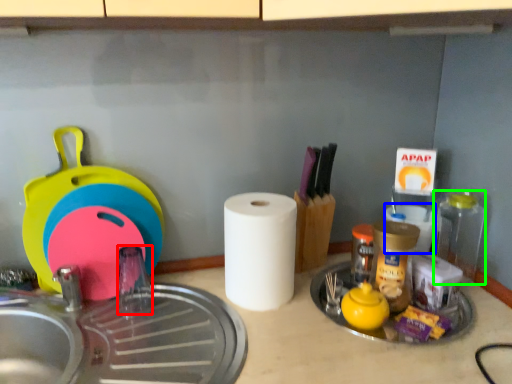
Question: Which object is positioned closest to faucet (highlighted by a red box)? Select from paper towel (highlighted by a blue box) and bottle (highlighted by a green box).

Choices:
 (A) paper towel
 (B) bottle

Answer: (A)